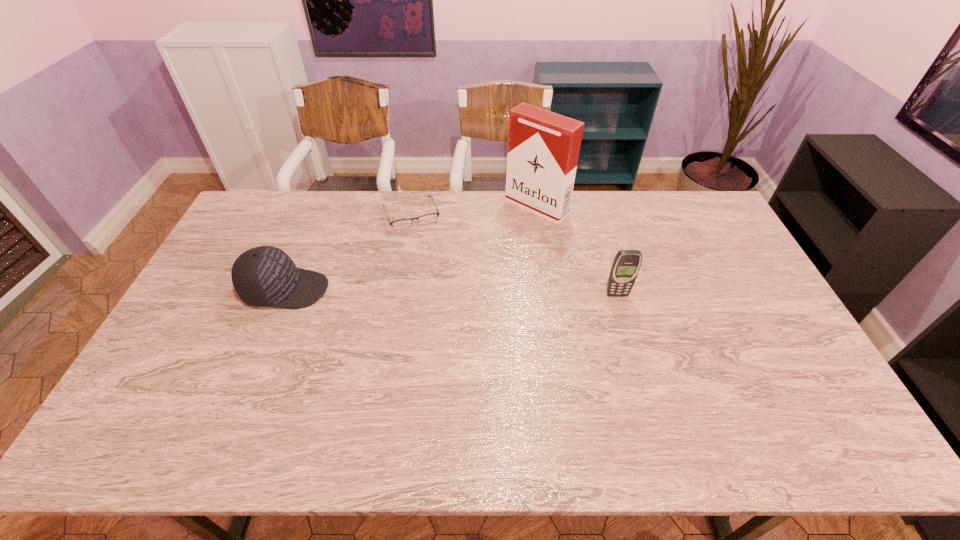
Identify the location of vacant area that lies between the baseball cap and the cigarette_case. (411, 248).

You are a GUI agent. You are given a task and a screenshot of the screen. Output one action in this format:
    pyautogui.click(x=<x>, y=<y>)
    Task: Click on the vacant space in between the tallest object and the second object from left to right
    This screenshot has height=540, width=960.
    Given the screenshot: What is the action you would take?
    pyautogui.click(x=473, y=211)

You are a GUI agent. You are given a task and a screenshot of the screen. Output one action in this format:
    pyautogui.click(x=<x>, y=<y>)
    Task: Click on the empty space between the spectacles and the baseball cap
    
    Given the screenshot: What is the action you would take?
    pyautogui.click(x=348, y=252)

This screenshot has height=540, width=960. In order to click on the closest object to the leftmost object in this screenshot , I will do `click(400, 224)`.

Where is `object that is the third closest to the leftmost object`? This screenshot has width=960, height=540. object that is the third closest to the leftmost object is located at coordinates (626, 265).